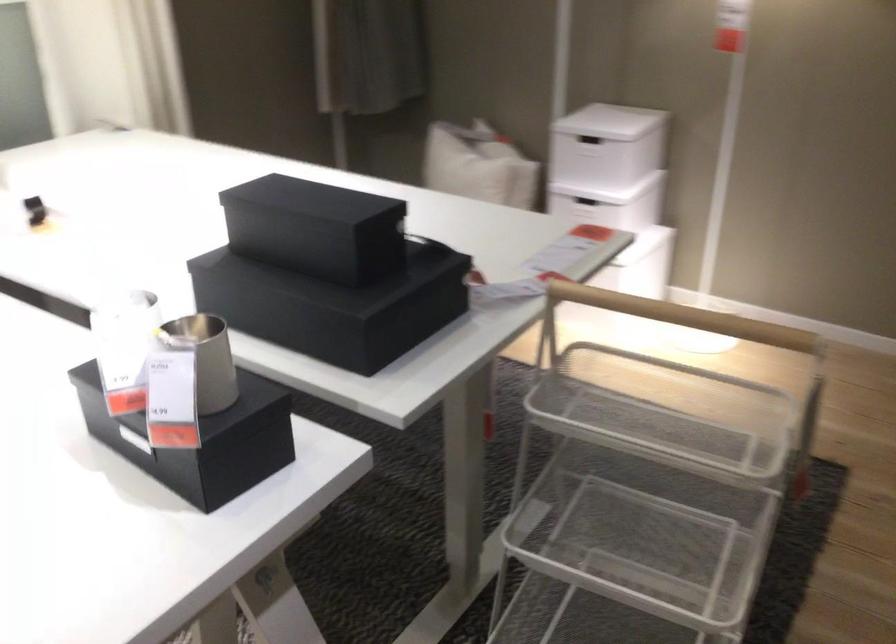
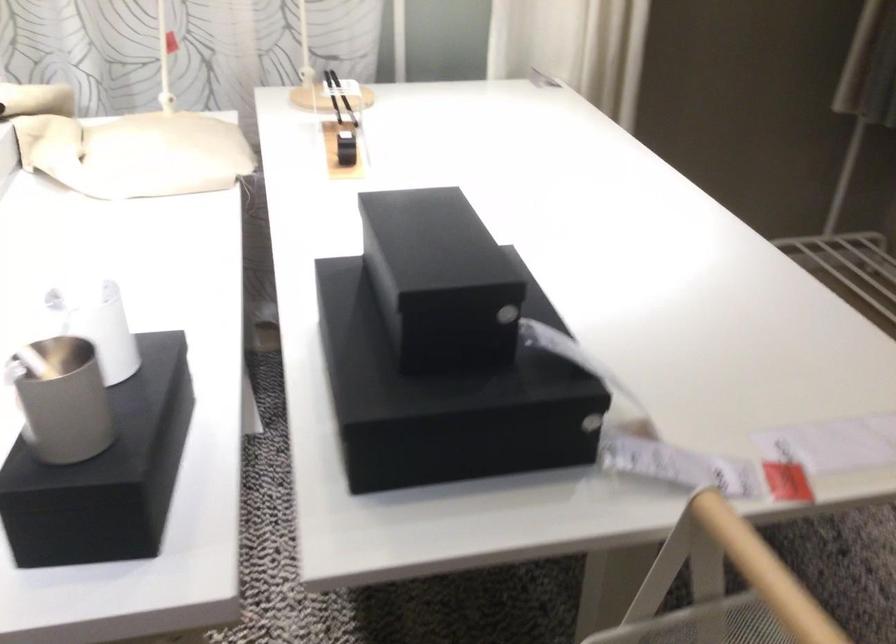
Question: The first image is from the beginning of the video and the second image is from the end. How did the camera likely rotate when shooting the video?

Choices:
 (A) Left
 (B) Right
 (C) Up
 (D) Down

Answer: (A)